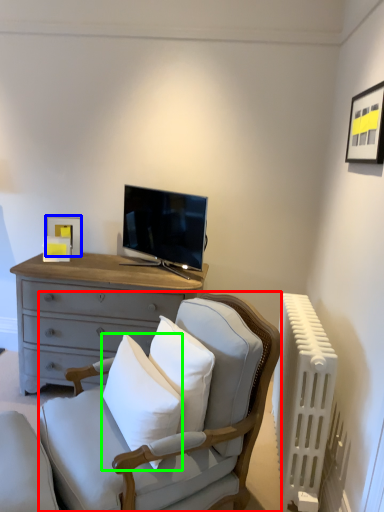
Question: Considering the real-world distances, which object is farthest from rocking chair (highlighted by a red box)? picture frame (highlighted by a blue box) or pillow (highlighted by a green box)?

Choices:
 (A) picture frame
 (B) pillow

Answer: (A)